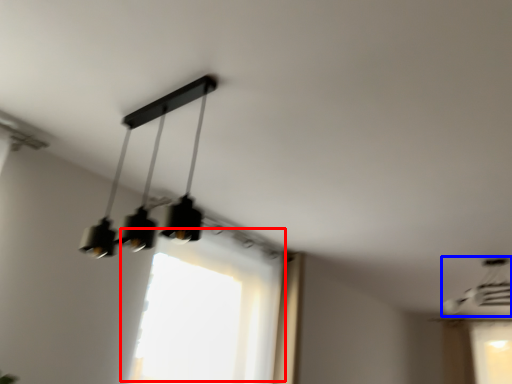
Question: Which point is further to the camera, window (highlighted by a red box) or lamp (highlighted by a blue box)?

Choices:
 (A) window
 (B) lamp

Answer: (B)